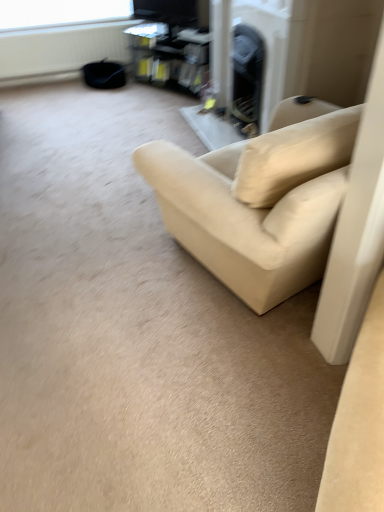
Question: Does beige fabric couch at center lie behind matte black entertainment center at upper center?

Choices:
 (A) no
 (B) yes

Answer: (A)

Question: Does beige fabric couch at center have a greater height compared to matte black entertainment center at upper center?

Choices:
 (A) yes
 (B) no

Answer: (A)

Question: Is beige fabric couch at center turned away from matte black entertainment center at upper center?

Choices:
 (A) no
 (B) yes

Answer: (A)

Question: Is beige fabric couch at center facing towards matte black entertainment center at upper center?

Choices:
 (A) no
 (B) yes

Answer: (B)

Question: From a real-world perspective, does beige fabric couch at center stand above matte black entertainment center at upper center?

Choices:
 (A) no
 (B) yes

Answer: (B)

Question: Is matte black entertainment center at upper center to the left or to the right of white matte radiator at upper left in the image?

Choices:
 (A) right
 (B) left

Answer: (A)

Question: Would you say matte black entertainment center at upper center is inside or outside white matte radiator at upper left?

Choices:
 (A) outside
 (B) inside

Answer: (A)

Question: From the image's perspective, relative to white matte radiator at upper left, is matte black entertainment center at upper center above or below?

Choices:
 (A) above
 (B) below

Answer: (B)

Question: From their relative heights in the image, would you say matte black entertainment center at upper center is taller or shorter than white matte radiator at upper left?

Choices:
 (A) tall
 (B) short

Answer: (A)

Question: In terms of width, does beige fabric couch at center look wider or thinner when compared to matte black entertainment center at upper center?

Choices:
 (A) thin
 (B) wide

Answer: (B)

Question: Considering the positions of point tap(274, 271) and point tap(150, 73), is point tap(274, 271) closer or farther from the camera than point tap(150, 73)?

Choices:
 (A) farther
 (B) closer

Answer: (B)

Question: Which is correct: beige fabric couch at center is inside matte black entertainment center at upper center, or outside of it?

Choices:
 (A) inside
 (B) outside

Answer: (B)

Question: Is beige fabric couch at center in front of or behind matte black entertainment center at upper center in the image?

Choices:
 (A) behind
 (B) front

Answer: (B)

Question: Is white matte radiator at upper left in front of or behind beige fabric couch at center in the image?

Choices:
 (A) behind
 (B) front

Answer: (A)

Question: Is point (79, 48) closer or farther from the camera than point (304, 234)?

Choices:
 (A) closer
 (B) farther

Answer: (B)